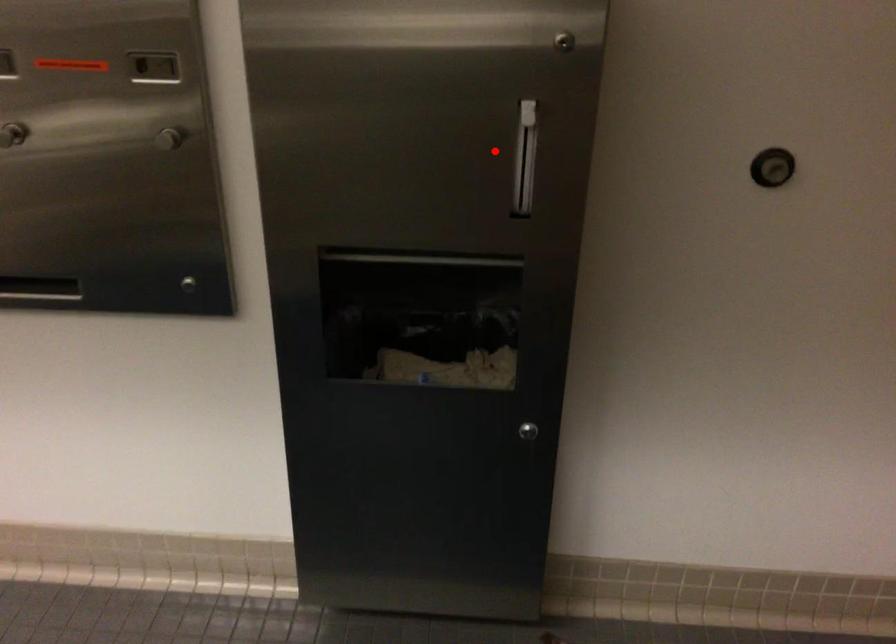
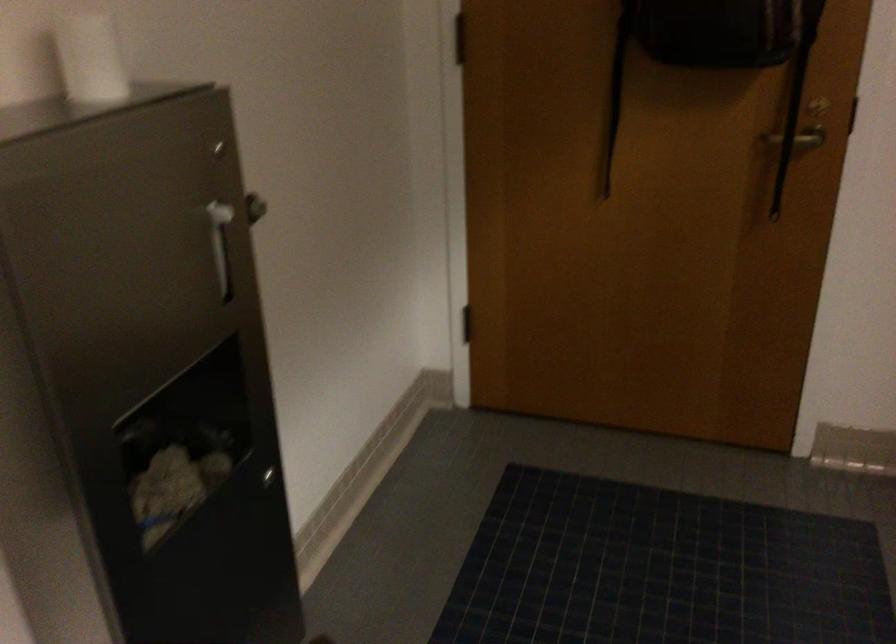
Question: I am providing you with two images of the same scene from different viewpoints. A red point is shown in image1. For the corresponding object point in image2, is it positioned nearer or farther from the camera?

Choices:
 (A) Nearer
 (B) Farther

Answer: (B)